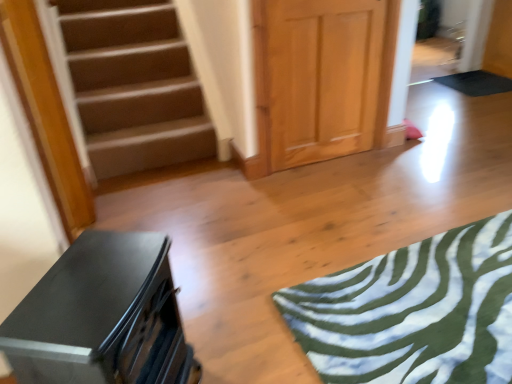
Where is `vacant region in front of light wood paneling at center`? Image resolution: width=512 pixels, height=384 pixels. vacant region in front of light wood paneling at center is located at coordinates (343, 190).